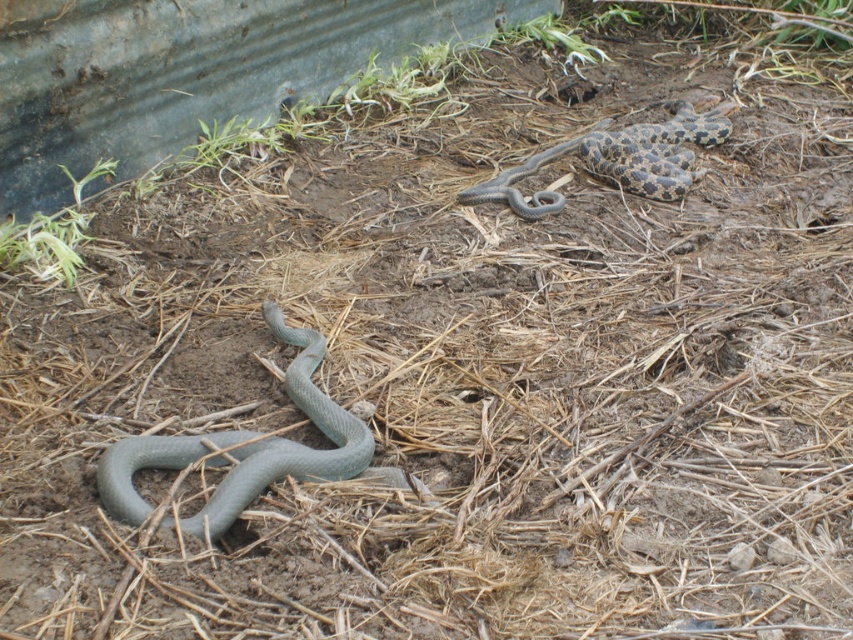
Question: Which point appears farthest from the camera in this image?

Choices:
 (A) (683, 134)
 (B) (318, 348)

Answer: (A)

Question: Can you confirm if matte gray snake at lower left is positioned to the left of speckled gray snake at upper right?

Choices:
 (A) no
 (B) yes

Answer: (B)

Question: Can you confirm if matte gray snake at lower left is positioned to the left of speckled gray snake at upper right?

Choices:
 (A) no
 (B) yes

Answer: (B)

Question: Which object is farther from the camera taking this photo?

Choices:
 (A) matte gray snake at lower left
 (B) speckled gray snake at upper right

Answer: (B)

Question: Is matte gray snake at lower left smaller than speckled gray snake at upper right?

Choices:
 (A) yes
 (B) no

Answer: (A)